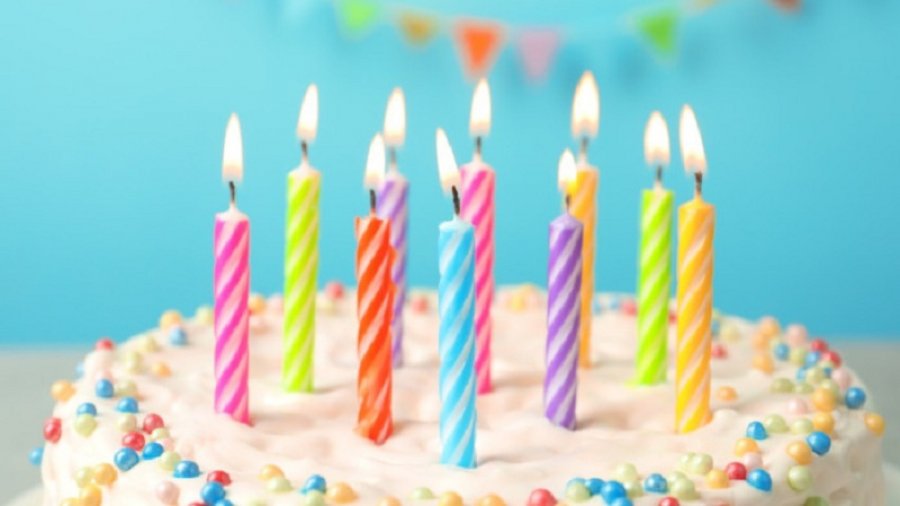
Identify the location of flame on candles. The image size is (900, 506). [x=230, y=146], [x=303, y=118], [x=372, y=168], [x=396, y=116], [x=439, y=158], [x=474, y=118], [x=562, y=171], [x=588, y=117], [x=648, y=132], [x=688, y=132].